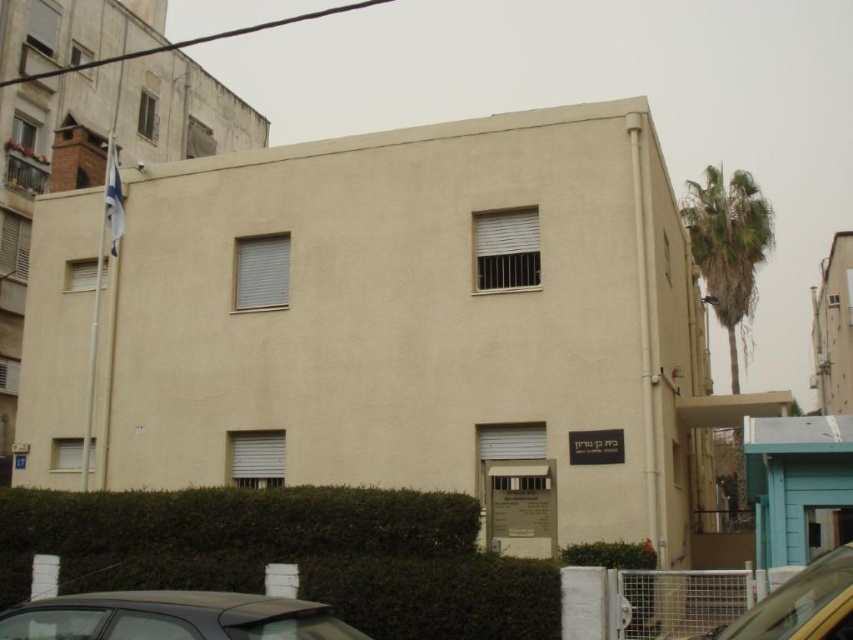
Looking at this image, you are standing at the entrance of the beige building and want to cross the street to reach a park. There is a dark gray matte car at lower left in your view. If the distance between you and the car is 4.95 meters, can you safely cross the street without being hit by the car if it starts moving forward? Assume the car can accelerate up to 15 km per hour.

The dark gray matte car at lower left is 4.95 meters away from you. To determine safety, consider the time it takes for the car to reach you. At 15 km per hour, the car moves at approximately 4.17 meters per second. At this speed, the car would cover 4.95 meters in about 1.19 seconds. Since humans can react and move quickly, it is advisable to wait until the car stops or slows down before crossing to ensure safety.

You are a delivery driver approaching the beige building. You need to park your vehicle, which is the same size as the dark gray matte car at lower left, in a spot that is to the right of the green leafy palm tree at upper right. Is this possible based on their current positions?

The dark gray matte car at lower left is to the left of the green leafy palm tree at upper right. Therefore, parking to the right of the green leafy palm tree at upper right would be possible as the car is already positioned to the left of it, implying space might be available on the right side.